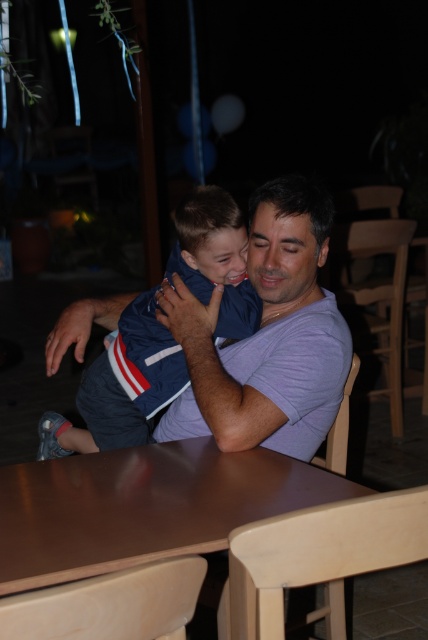
From the picture: Who is more distant from viewer, (47, 556) or (172, 268)?

Point (172, 268)

Based on the photo, between brown wooden table at center and blue fabric baby at center, which one has less height?

Standing shorter between the two is brown wooden table at center.

Is point (267, 500) closer to viewer compared to point (133, 342)?

Yes.

Find the location of a particular element. The width and height of the screenshot is (428, 640). brown wooden table at center is located at coordinates (143, 506).